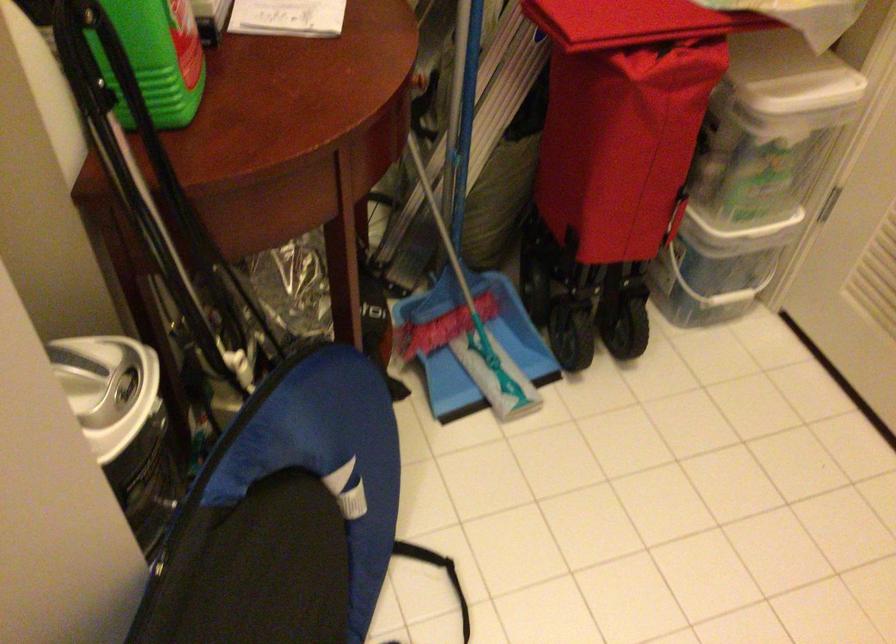
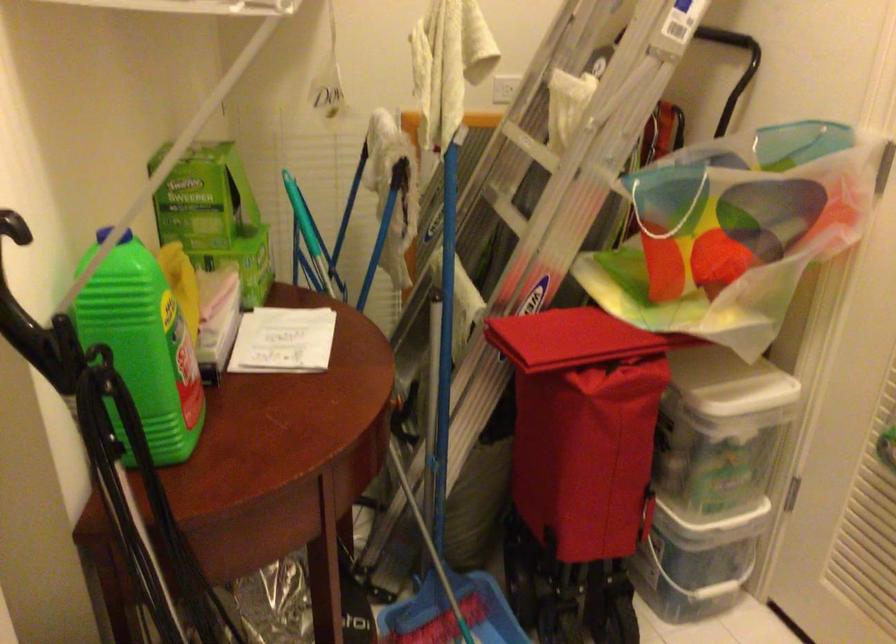
Question: The images are taken continuously from a first-person perspective. In which direction is your viewpoint rotating?

Choices:
 (A) Left
 (B) Right
 (C) Up
 (D) Down

Answer: (C)